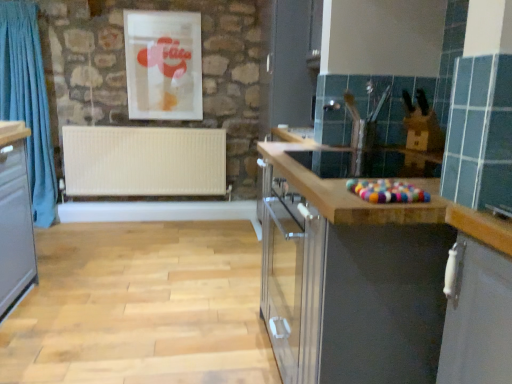
The width and height of the screenshot is (512, 384). Describe the element at coordinates (163, 65) in the screenshot. I see `matte plastic picture frame at upper center` at that location.

What is the approximate width of matte plastic picture frame at upper center?

matte plastic picture frame at upper center is 2.36 inches in width.

Locate an element on the screen. The image size is (512, 384). blue fabric curtain at left is located at coordinates (28, 100).

This screenshot has width=512, height=384. Identify the location of cabinetry on the right side of white matte radiator at center. (351, 267).

How distant is matte wood countertop at center from white matte radiator at center?

2.06 meters.

Looking at the image, does matte wood countertop at center seem bigger or smaller compared to white matte radiator at center?

In the image, matte wood countertop at center appears to be larger than white matte radiator at center.

Considering the sizes of objects matte wood countertop at center and white matte radiator at center in the image provided, who is wider, matte wood countertop at center or white matte radiator at center?

Wider between the two is matte wood countertop at center.

Is white matte radiator at center positioned far away from matte plastic picture frame at upper center?

They are positioned close to each other.

Is white matte radiator at center at the left side of matte plastic picture frame at upper center?

Yes.

Between white matte radiator at center and matte plastic picture frame at upper center, which one is positioned in front?

matte plastic picture frame at upper center is in front.

Considering the sizes of objects white matte radiator at center and matte plastic picture frame at upper center in the image provided, who is thinner, white matte radiator at center or matte plastic picture frame at upper center?

matte plastic picture frame at upper center is thinner.

Identify the location of radiator on the right side of blue fabric curtain at left. (143, 161).

Which is further, (165, 165) or (4, 109)?

Positioned behind is point (165, 165).

From the image's perspective, who appears lower, white matte radiator at center or blue fabric curtain at left?

white matte radiator at center, from the image's perspective.

Are white matte radiator at center and blue fabric curtain at left far apart?

white matte radiator at center is near blue fabric curtain at left, not far away.

From a real-world perspective, which is physically below, white matte radiator at center or matte wood countertop at center?

matte wood countertop at center, from a real-world perspective.

Relative to matte wood countertop at center, is white matte radiator at center in front or behind?

white matte radiator at center is behind matte wood countertop at center.

Considering the sizes of white matte radiator at center and matte wood countertop at center in the image, is white matte radiator at center taller or shorter than matte wood countertop at center?

Considering their sizes, white matte radiator at center has less height than matte wood countertop at center.

Could you tell me if white matte radiator at center is facing matte wood countertop at center?

Yes.

Can you confirm if blue fabric curtain at left is taller than white matte radiator at center?

Correct, blue fabric curtain at left is much taller as white matte radiator at center.

How different are the orientations of blue fabric curtain at left and white matte radiator at center in degrees?

1.66 degrees separate the facing orientations of blue fabric curtain at left and white matte radiator at center.

Would you say blue fabric curtain at left is to the left or to the right of white matte radiator at center in the picture?

blue fabric curtain at left is positioned on white matte radiator at center's left side.

Can you see blue fabric curtain at left touching white matte radiator at center?

No, blue fabric curtain at left is not with white matte radiator at center.

Is matte wood countertop at center further to the viewer compared to blue fabric curtain at left?

No, matte wood countertop at center is closer to the camera.

Is point (374, 207) closer or farther from the camera than point (19, 66)?

Point (374, 207).

Visually, is matte wood countertop at center positioned to the left or to the right of blue fabric curtain at left?

Based on their positions, matte wood countertop at center is located to the right of blue fabric curtain at left.

Which of these two, blue fabric curtain at left or matte plastic picture frame at upper center, is bigger?

blue fabric curtain at left is bigger.

Which object is more forward, blue fabric curtain at left or matte plastic picture frame at upper center?

Positioned in front is blue fabric curtain at left.

Between blue fabric curtain at left and matte plastic picture frame at upper center, which one has larger width?

blue fabric curtain at left is wider.

This screenshot has height=384, width=512. I want to click on cabinetry that appears below the white matte radiator at center (from the image's perspective), so click(351, 267).

This screenshot has height=384, width=512. What are the coordinates of `picture frame that is on the right side of white matte radiator at center` in the screenshot? It's located at (163, 65).

From the image, which object appears to be farther from matte wood countertop at center, matte plastic picture frame at upper center or white matte radiator at center?

Based on the image, matte plastic picture frame at upper center appears to be further to matte wood countertop at center.

Which object lies further to the anchor point white matte radiator at center, matte wood countertop at center or matte plastic picture frame at upper center?

matte wood countertop at center lies further to white matte radiator at center than the other object.

From the image, which object appears to be farther from matte plastic picture frame at upper center, blue fabric curtain at left or matte wood countertop at center?

matte wood countertop at center lies further to matte plastic picture frame at upper center than the other object.

Based on the photo, looking at the image, which one is located further to matte plastic picture frame at upper center, matte wood countertop at center or blue fabric curtain at left?

matte wood countertop at center is positioned further to the anchor matte plastic picture frame at upper center.

Consider the image. Looking at the image, which one is located further to blue fabric curtain at left, matte plastic picture frame at upper center or white matte radiator at center?

The object further to blue fabric curtain at left is matte plastic picture frame at upper center.

Which object lies further to the anchor point matte wood countertop at center, white matte radiator at center or matte plastic picture frame at upper center?

matte plastic picture frame at upper center lies further to matte wood countertop at center than the other object.

From the picture: Looking at the image, which one is located closer to white matte radiator at center, matte plastic picture frame at upper center or matte wood countertop at center?

Among the two, matte plastic picture frame at upper center is located nearer to white matte radiator at center.

Considering their positions, is white matte radiator at center positioned closer to matte plastic picture frame at upper center than matte wood countertop at center?

white matte radiator at center is positioned closer to the anchor matte plastic picture frame at upper center.

Locate an element on the screen. The height and width of the screenshot is (384, 512). radiator situated between blue fabric curtain at left and matte plastic picture frame at upper center from left to right is located at coordinates (143, 161).

Locate an element on the screen. This screenshot has width=512, height=384. curtain positioned between matte wood countertop at center and matte plastic picture frame at upper center from near to far is located at coordinates (28, 100).

Identify the location of picture frame between matte wood countertop at center and white matte radiator at center along the z-axis. The width and height of the screenshot is (512, 384). (163, 65).

In order to click on curtain located between matte wood countertop at center and white matte radiator at center in the depth direction in this screenshot , I will do `click(28, 100)`.